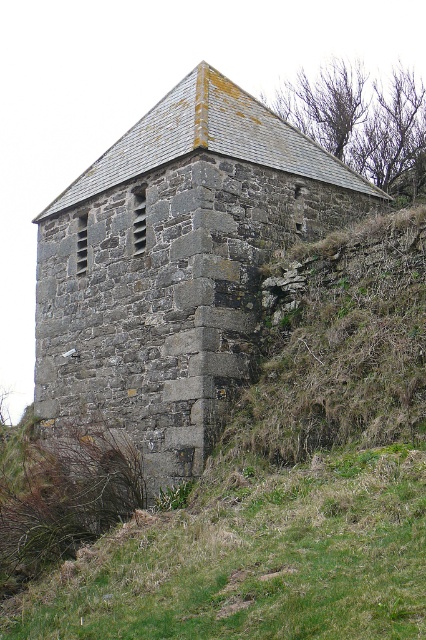
You are standing at the base of the gray stone tower at center and looking towards the green grassy at lower center. Which object is higher in elevation?

The gray stone tower at center is taller than the green grassy at lower center, so the tower is higher in elevation.